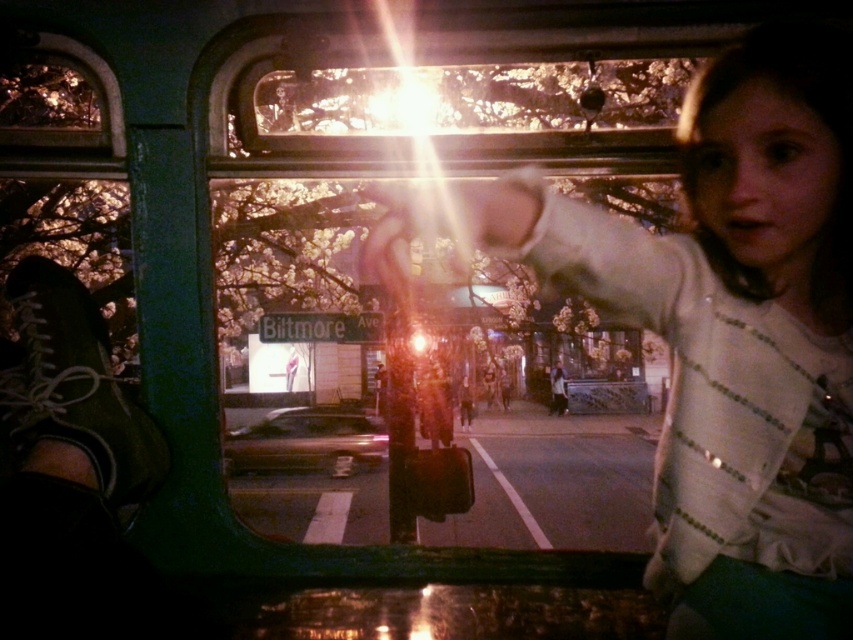
You are sitting in a car at night and notice two items on the passenger seat through the window. The items are the white cotton shirt at center and the smooth leather jacket at center. Which item is positioned to the right when viewed from inside the car?

The white cotton shirt at center is positioned to the right of the smooth leather jacket at center when viewed from inside the car.

You are a passenger in a car and see the shiny metallic car at center and the white cotton shirt at center through the window. Which object is closer to the left side of the window?

The shiny metallic car at center is closer to the left side of the window than the white cotton shirt at center.

You are a delivery person trying to fit a package that is 1.2 meters wide into the back of the shiny metallic car at center. You also see a smooth leather jacket at center nearby. Can you determine if the car will fit the package?

The shiny metallic car at center might be wider than the smooth leather jacket at center, but since the jacket is not a car, its width is irrelevant. The description does not provide the car or jacket width, so I cannot confirm if the package will fit.